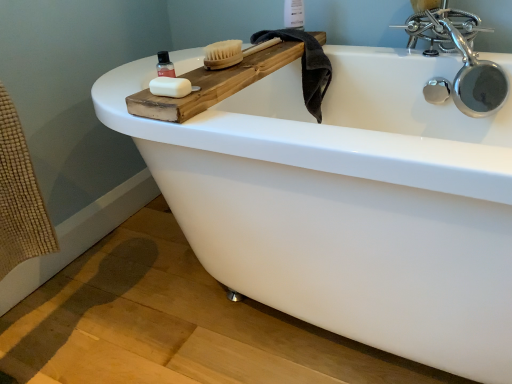
Question: Is white plastic bottle at upper center bigger than dark gray towel at upper right?

Choices:
 (A) yes
 (B) no

Answer: (B)

Question: Is white plastic bottle at upper center oriented towards dark gray towel at upper right?

Choices:
 (A) no
 (B) yes

Answer: (A)

Question: Is white plastic bottle at upper center thinner than dark gray towel at upper right?

Choices:
 (A) no
 (B) yes

Answer: (B)

Question: From a real-world perspective, is white plastic bottle at upper center located higher than dark gray towel at upper right?

Choices:
 (A) yes
 (B) no

Answer: (A)

Question: Could dark gray towel at upper right be considered to be inside white plastic bottle at upper center?

Choices:
 (A) yes
 (B) no

Answer: (B)

Question: Considering the relative sizes of white plastic bottle at upper center and dark gray towel at upper right in the image provided, is white plastic bottle at upper center shorter than dark gray towel at upper right?

Choices:
 (A) yes
 (B) no

Answer: (A)

Question: Can you confirm if translucent plastic bottle at upper left is smaller than natural wood brush at upper center?

Choices:
 (A) yes
 (B) no

Answer: (A)

Question: Is translucent plastic bottle at upper left closer to camera compared to natural wood brush at upper center?

Choices:
 (A) yes
 (B) no

Answer: (A)

Question: From a real-world perspective, is translucent plastic bottle at upper left on top of natural wood brush at upper center?

Choices:
 (A) yes
 (B) no

Answer: (A)

Question: Does translucent plastic bottle at upper left appear on the left side of natural wood brush at upper center?

Choices:
 (A) no
 (B) yes

Answer: (B)

Question: Is translucent plastic bottle at upper left not close to natural wood brush at upper center?

Choices:
 (A) yes
 (B) no

Answer: (B)

Question: From the image's perspective, would you say translucent plastic bottle at upper left is positioned over natural wood brush at upper center?

Choices:
 (A) yes
 (B) no

Answer: (B)

Question: Is white matte soap at upper left a part of translucent plastic bottle at upper left?

Choices:
 (A) yes
 (B) no

Answer: (B)